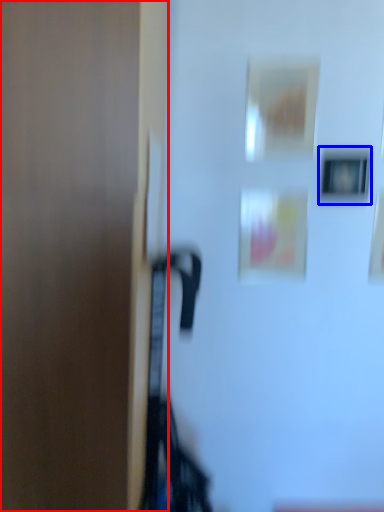
Question: Which object is closer to the camera taking this photo, door (highlighted by a red box) or picture frame (highlighted by a blue box)?

Choices:
 (A) door
 (B) picture frame

Answer: (A)